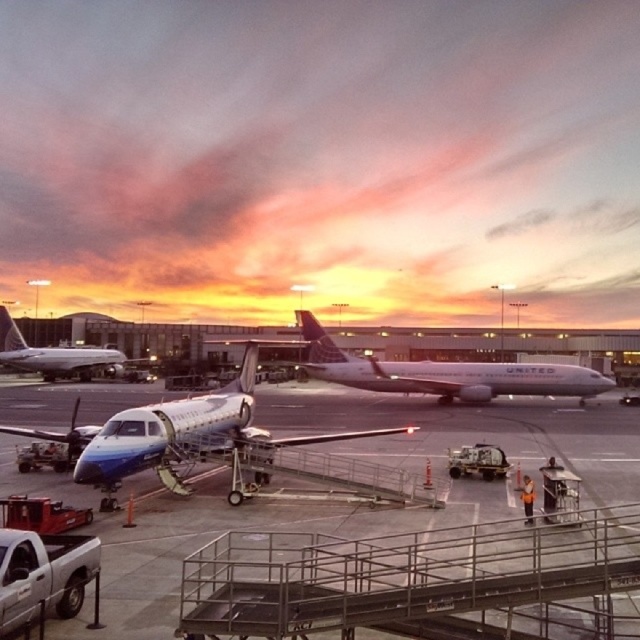
Question: Is white glossy airliner at center wider than white glossy airplane at center?

Choices:
 (A) yes
 (B) no

Answer: (A)

Question: Is metallic blue airplane at center smaller than white glossy airliner at center?

Choices:
 (A) yes
 (B) no

Answer: (A)

Question: Is white glossy airliner at center smaller than white glossy airplane at center?

Choices:
 (A) no
 (B) yes

Answer: (A)

Question: Which object is positioned farthest from the metallic blue airplane at center?

Choices:
 (A) metallic blue airplane at center-left
 (B) white glossy airliner at center

Answer: (B)

Question: Which is nearer to the metallic blue airplane at center-left?

Choices:
 (A) metallic blue airplane at center
 (B) white glossy airliner at center

Answer: (A)

Question: Which object appears farthest from the camera in this image?

Choices:
 (A) metallic blue airplane at center-left
 (B) white glossy airplane at center

Answer: (B)